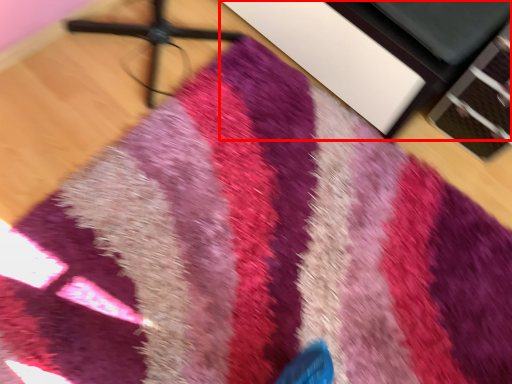
Question: From the image's perspective, what is the correct spatial relationship of furniture (annotated by the red box) in relation to tripod?

Choices:
 (A) below
 (B) above

Answer: (B)